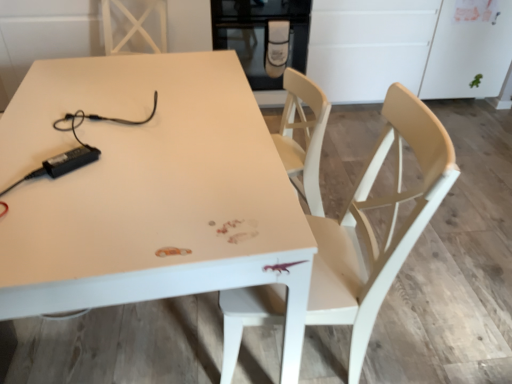
Question: From the image's perspective, is black glass oven at upper center located above white glossy table at center?

Choices:
 (A) no
 (B) yes

Answer: (B)

Question: Does black glass oven at upper center have a smaller size compared to white glossy table at center?

Choices:
 (A) no
 (B) yes

Answer: (B)

Question: Considering the relative positions of black glass oven at upper center and white glossy table at center in the image provided, is black glass oven at upper center in front of white glossy table at center?

Choices:
 (A) yes
 (B) no

Answer: (B)

Question: Considering the relative sizes of black glass oven at upper center and white glossy table at center in the image provided, is black glass oven at upper center bigger than white glossy table at center?

Choices:
 (A) no
 (B) yes

Answer: (A)

Question: Is black glass oven at upper center to the left of white glossy table at center from the viewer's perspective?

Choices:
 (A) yes
 (B) no

Answer: (B)

Question: Can you confirm if black glass oven at upper center is wider than white glossy table at center?

Choices:
 (A) no
 (B) yes

Answer: (A)

Question: Does light wood chair at center have a smaller size compared to black glass oven at upper center?

Choices:
 (A) yes
 (B) no

Answer: (B)

Question: Is the depth of light wood chair at center less than that of black glass oven at upper center?

Choices:
 (A) yes
 (B) no

Answer: (A)

Question: Is light wood chair at center touching black glass oven at upper center?

Choices:
 (A) yes
 (B) no

Answer: (B)

Question: Is the position of light wood chair at center more distant than that of black glass oven at upper center?

Choices:
 (A) no
 (B) yes

Answer: (A)

Question: From the image's perspective, is light wood chair at center below black glass oven at upper center?

Choices:
 (A) no
 (B) yes

Answer: (B)

Question: Can you confirm if light wood chair at center is shorter than black glass oven at upper center?

Choices:
 (A) no
 (B) yes

Answer: (A)

Question: Can you confirm if black glass oven at upper center is smaller than light wood chair at center?

Choices:
 (A) no
 (B) yes

Answer: (B)